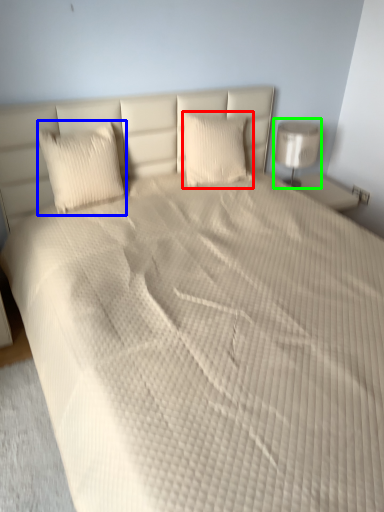
Question: Which is farther away from pillow (highlighted by a red box)? pillow (highlighted by a blue box) or lamp (highlighted by a green box)?

Choices:
 (A) pillow
 (B) lamp

Answer: (A)